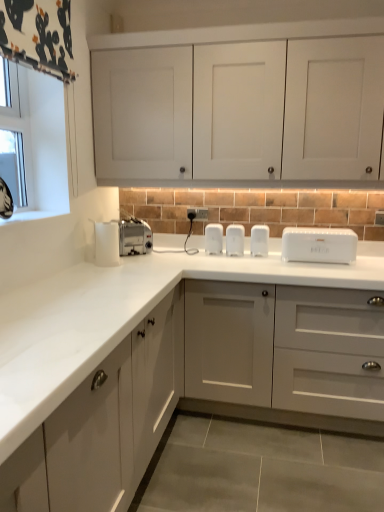
The width and height of the screenshot is (384, 512). Find the location of `free space in front of white plastic toaster at center, the 2th appliance positioned from the left`. free space in front of white plastic toaster at center, the 2th appliance positioned from the left is located at coordinates (226, 256).